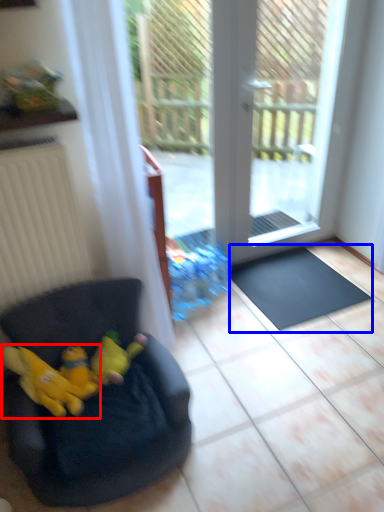
Question: Which object is further to the camera taking this photo, animal (highlighted by a red box) or doormat (highlighted by a blue box)?

Choices:
 (A) animal
 (B) doormat

Answer: (B)